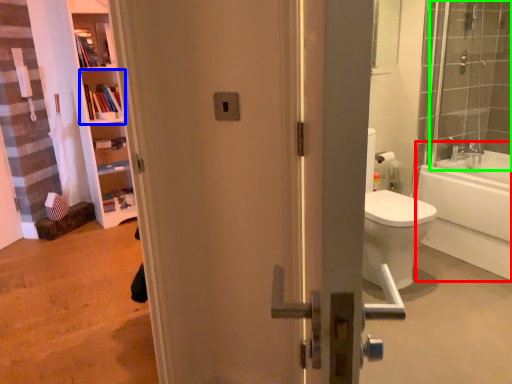
Question: Estimate the real-world distances between objects in this image. Which object is farther from bathtub (highlighted by a red box), shelf (highlighted by a blue box) or shower door (highlighted by a green box)?

Choices:
 (A) shelf
 (B) shower door

Answer: (A)